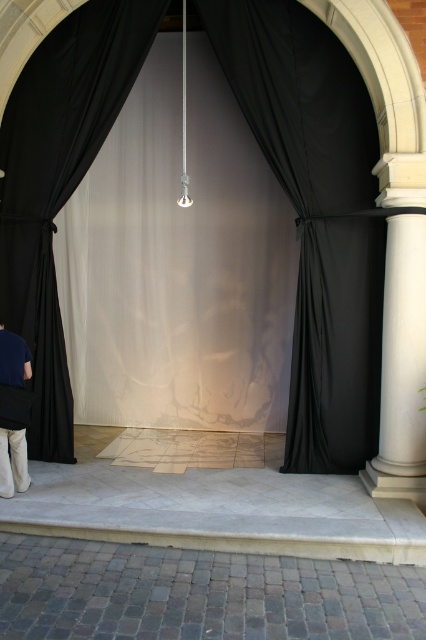
Can you confirm if black silk curtain at center is bigger than white marble stage at center?

Actually, black silk curtain at center might be smaller than white marble stage at center.

Is black silk curtain at center smaller than white marble stage at center?

Indeed, black silk curtain at center has a smaller size compared to white marble stage at center.

This screenshot has width=426, height=640. What do you see at coordinates (316, 216) in the screenshot?
I see `black silk curtain at center` at bounding box center [316, 216].

I want to click on black silk curtain at center, so click(316, 216).

Is black silk curtain at center bigger than khaki cotton pants at lower left?

Yes.

Measure the distance between point (238, 45) and camera.

Point (238, 45) and camera are 5.51 meters apart from each other.

Does point (328, 68) come closer to viewer compared to point (17, 381)?

No.

Locate an element on the screen. The image size is (426, 640). black silk curtain at center is located at coordinates (316, 216).

Between point (379, 561) and point (8, 488), which one is positioned behind?

The point (8, 488) is behind.

Does white marble stage at center have a greater width compared to khaki cotton pants at lower left?

Indeed, white marble stage at center has a greater width compared to khaki cotton pants at lower left.

Where is `white marble stage at center`? The height and width of the screenshot is (640, 426). white marble stage at center is located at coordinates (215, 506).